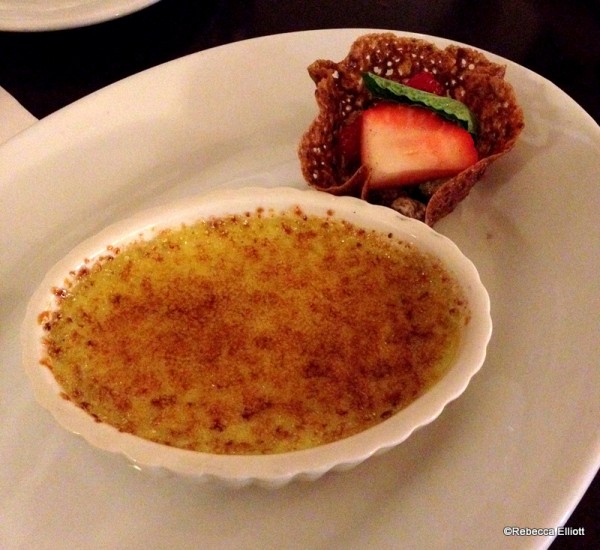
This screenshot has height=550, width=600. I want to click on bowl, so click(370, 453).